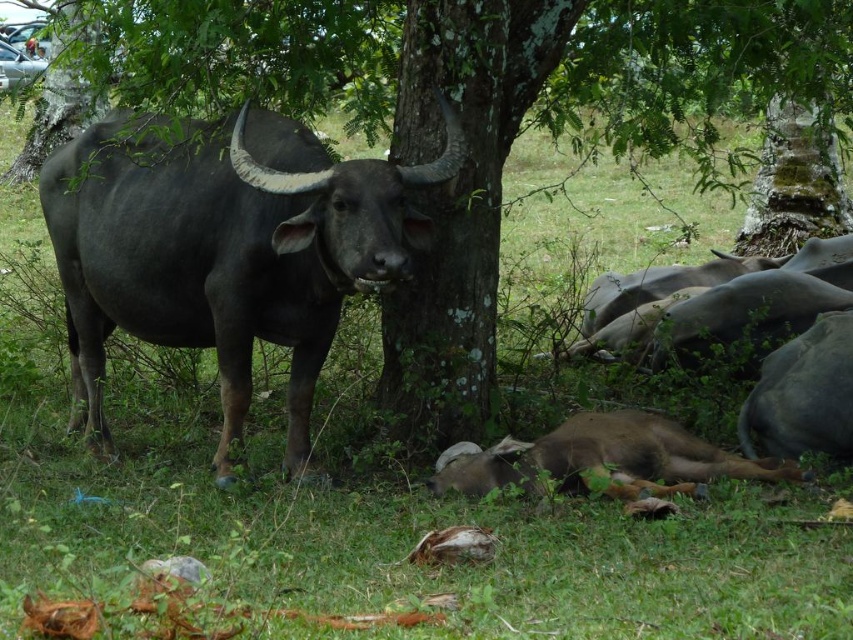
Question: Is green rough bark tree at center positioned behind shiny black bull at center?

Choices:
 (A) no
 (B) yes

Answer: (B)

Question: Among these points, which one is farthest from the camera?

Choices:
 (A) (184, 253)
 (B) (839, 104)

Answer: (B)

Question: Does green rough bark tree at center have a lesser width compared to shiny black bull at center?

Choices:
 (A) yes
 (B) no

Answer: (A)

Question: Which point is closer to the camera taking this photo?

Choices:
 (A) (483, 378)
 (B) (88, 296)

Answer: (B)

Question: Is green rough bark tree at center below shiny black bull at center?

Choices:
 (A) yes
 (B) no

Answer: (B)